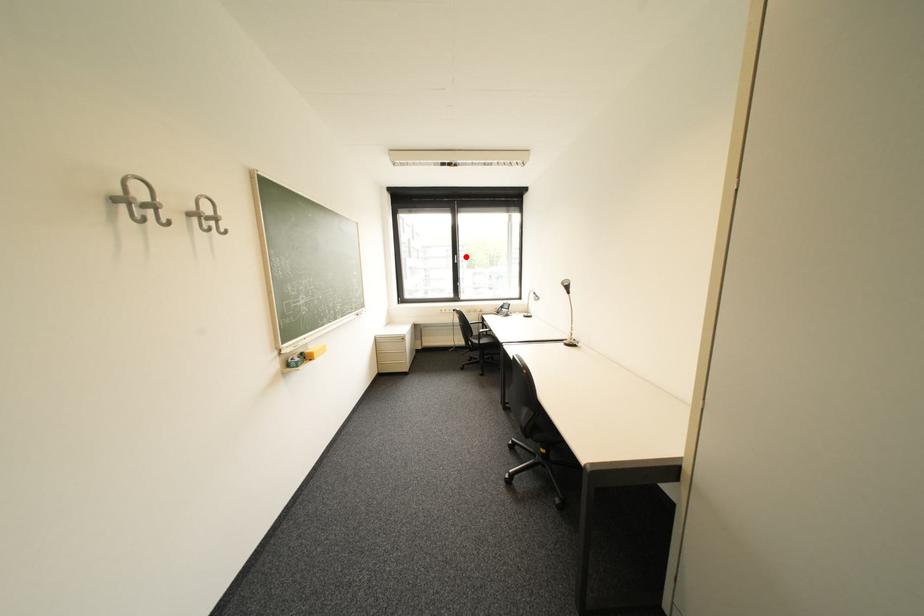
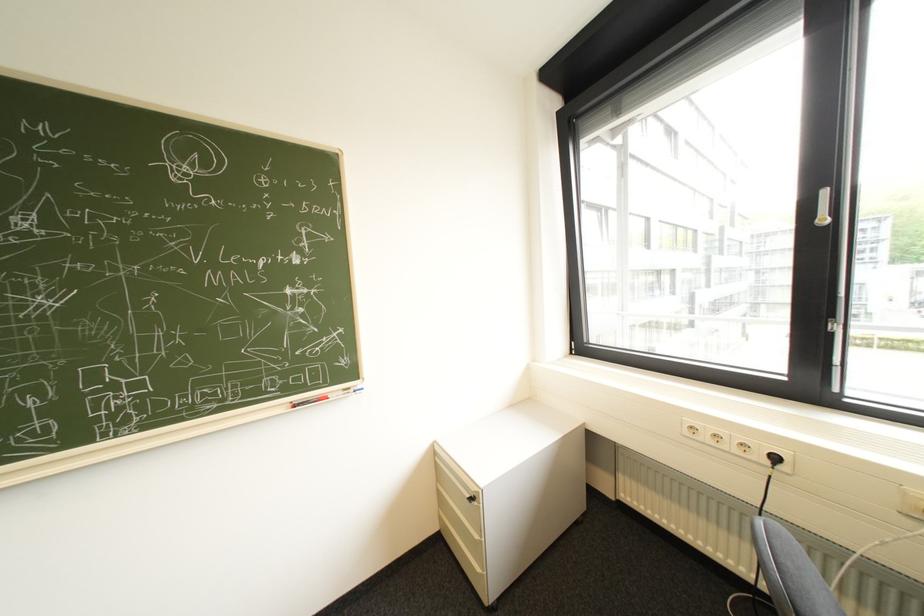
The point at the highlighted location is marked in the first image. Where is the corresponding point in the second image?

(834, 193)